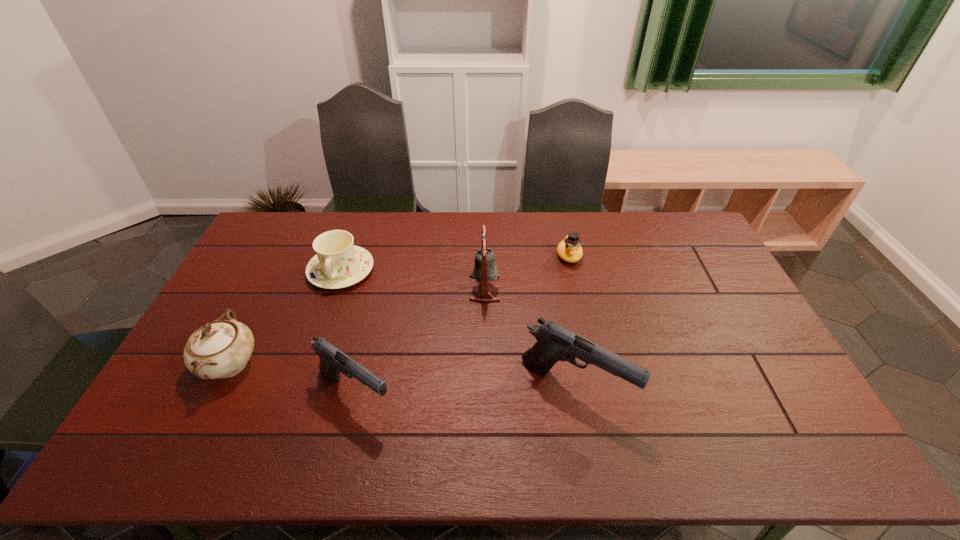
The height and width of the screenshot is (540, 960). Find the location of `vacant position located 0.360m on the handle side of the right chinaware`. vacant position located 0.360m on the handle side of the right chinaware is located at coordinates (300, 390).

Find the location of a particular element. Image resolution: width=960 pixels, height=540 pixels. vacant space located 0.400m on the front-facing side of the duck is located at coordinates (593, 363).

You are a GUI agent. You are given a task and a screenshot of the screen. Output one action in this format:
    pyautogui.click(x=<x>, y=<y>)
    Task: Click on the vacant area situated on the front of the bell
    
    Given the screenshot: What is the action you would take?
    pyautogui.click(x=485, y=328)

Locate an element on the screen. This screenshot has height=540, width=960. vacant space located 0.340m on the right of the left chinaware is located at coordinates (382, 364).

Where is `chinaware situated at the far edge`? This screenshot has width=960, height=540. chinaware situated at the far edge is located at coordinates [338, 263].

At what (x,y) coordinates should I click in order to perform the action: click on duck present at the far edge. Please return your answer as a coordinate pair (x, y). Looking at the image, I should click on (569, 249).

The image size is (960, 540). In order to click on chinaware that is at the near edge in this screenshot , I will do `click(220, 349)`.

This screenshot has width=960, height=540. Identify the location of object positioned at the left edge. (220, 349).

This screenshot has width=960, height=540. I want to click on object that is at the near left corner, so click(x=220, y=349).

Find the location of a particular element. This screenshot has height=540, width=960. free space at the far edge of the desktop is located at coordinates tap(382, 213).